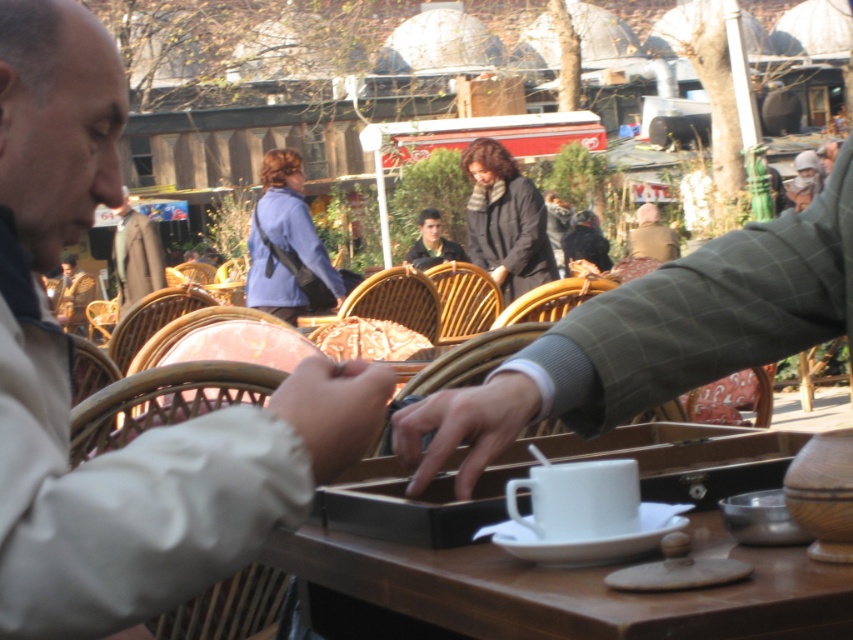
Between fuzzy beige hand at center and golden textured bread at center, which one is positioned higher?

golden textured bread at center

Does fuzzy beige hand at center have a smaller size compared to golden textured bread at center?

Yes, fuzzy beige hand at center is smaller than golden textured bread at center.

The width and height of the screenshot is (853, 640). I want to click on fuzzy beige hand at center, so click(334, 410).

This screenshot has width=853, height=640. Identify the location of fuzzy beige hand at center. (334, 410).

Image resolution: width=853 pixels, height=640 pixels. What are the coordinates of `light beige jacket at upper left` in the screenshot? It's located at (68, 385).

Describe the element at coordinates (68, 385) in the screenshot. The width and height of the screenshot is (853, 640). I see `light beige jacket at upper left` at that location.

Where is `light beige jacket at upper left`? The width and height of the screenshot is (853, 640). light beige jacket at upper left is located at coordinates (68, 385).

The image size is (853, 640). Find the location of `light beige jacket at upper left`. light beige jacket at upper left is located at coordinates (68, 385).

Is point (592, 449) closer to viewer compared to point (485, 417)?

No, it is not.

Image resolution: width=853 pixels, height=640 pixels. What are the coordinates of `brown wooden table at center` in the screenshot? It's located at (566, 568).